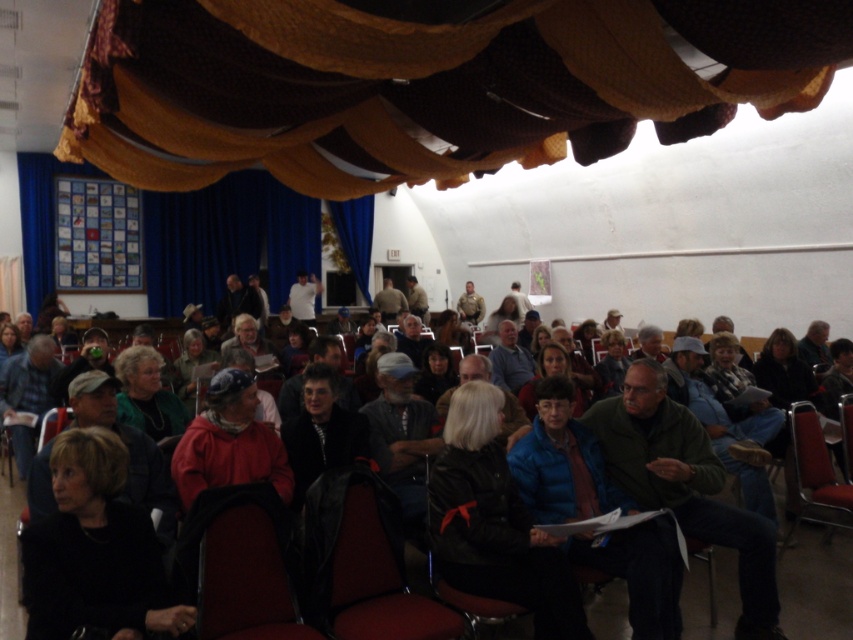
You are sitting in the front row of the hall and notice two jackets hanging on the back of the chairs in front of you. Which jacket is closer to you, the blue fabric jacket at center or the camouflage fabric jacket at center?

The blue fabric jacket at center is closer to you since it is in front of the camouflage fabric jacket at center.

You are organizing a fire drill and need to quickly move from the green matte jacket at center to the blue plaid shirt at center. Given that the shortest path between them is 4.45 meters, can you estimate how many seconds it would take for an average person to walk that distance at a normal pace?

The distance between the green matte jacket at center and the blue plaid shirt at center is 4.45 meters. An average person walking at a normal pace of about 1.4 meters per second would take approximately 3.18 seconds to cover this distance. Therefore, it would take roughly 3 seconds.